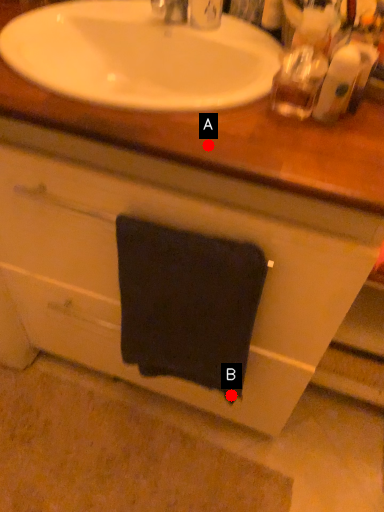
Question: Two points are circled on the image, labeled by A and B beside each circle. Which of the following is the closest to the observer?

Choices:
 (A) A is closer
 (B) B is closer

Answer: (A)